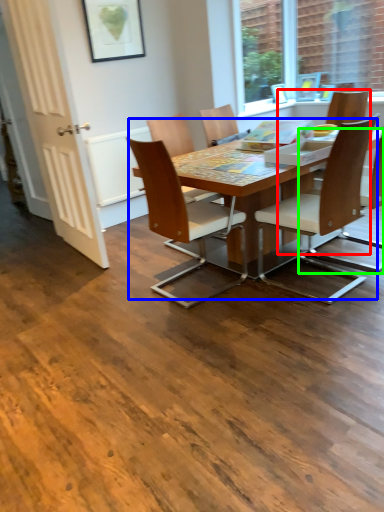
Question: Estimate the real-world distances between objects in this image. Which object is closer to chair (highlighted by a red box), kitchen & dining room table (highlighted by a blue box) or chair (highlighted by a green box)?

Choices:
 (A) kitchen & dining room table
 (B) chair

Answer: (B)